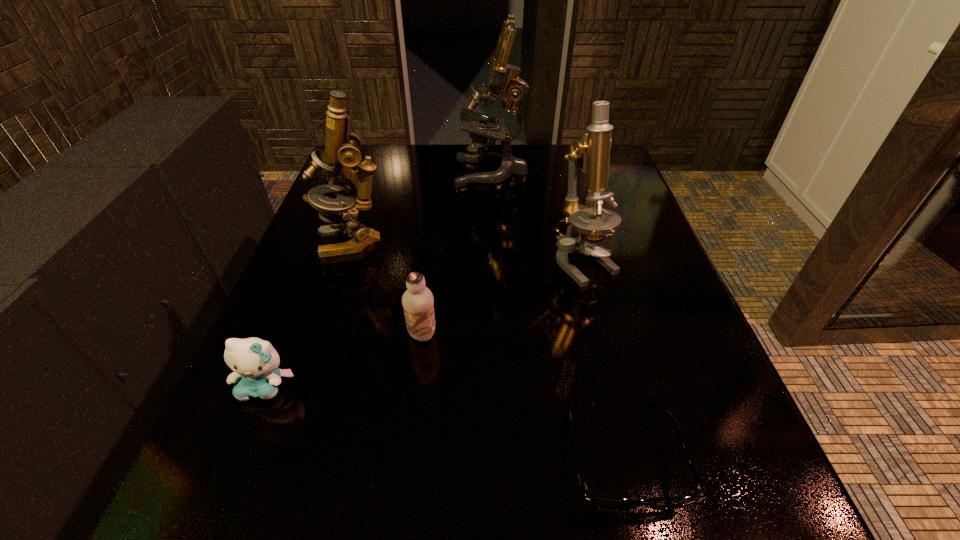
Locate an element on the screen. The height and width of the screenshot is (540, 960). the farthest object is located at coordinates 502,77.

Where is `the farthest microscope`? The width and height of the screenshot is (960, 540). the farthest microscope is located at coordinates (502, 77).

Find the location of a particular element. This screenshot has width=960, height=540. the rightmost microscope is located at coordinates [585, 225].

I want to click on the leftmost microscope, so click(341, 153).

Where is `chocolate milk`? The image size is (960, 540). chocolate milk is located at coordinates (417, 301).

I want to click on the third shortest object, so click(x=417, y=301).

Locate an element on the screen. The image size is (960, 540). the second shortest object is located at coordinates (255, 362).

You are a GUI agent. You are given a task and a screenshot of the screen. Output one action in this format:
    pyautogui.click(x=<x>, y=<y>)
    Task: Click on the shortest object
    The width and height of the screenshot is (960, 540).
    Given the screenshot: What is the action you would take?
    pyautogui.click(x=599, y=501)

The height and width of the screenshot is (540, 960). Identify the location of free space located at the eyepieces of the farthest object. (386, 171).

Identify the location of vacant region located at the eyepieces of the farthest object. The image size is (960, 540). point(363,171).